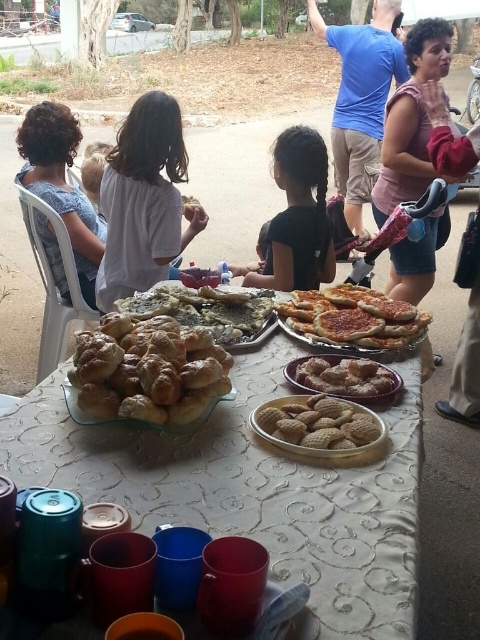
Based on the photo, you are at a community event and see the black matte shirt at center and the golden brown crumbly cookies at center on the table. Which item is taller?

The black matte shirt at center is taller than the golden brown crumbly cookies at center.

From the picture: You are at a community event and see two people wearing blue shirts. One is wearing a blue cotton shirt at upper center and the other a blue denim shirt at left. Which person is standing higher up?

The blue cotton shirt at upper center is much taller than the blue denim shirt at left, so the person wearing the blue cotton shirt at upper center is standing higher up.